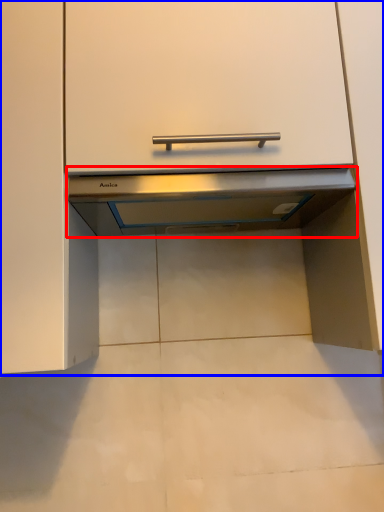
Question: Which object is further to the camera taking this photo, exhaust hood (highlighted by a red box) or cabinetry (highlighted by a blue box)?

Choices:
 (A) exhaust hood
 (B) cabinetry

Answer: (A)